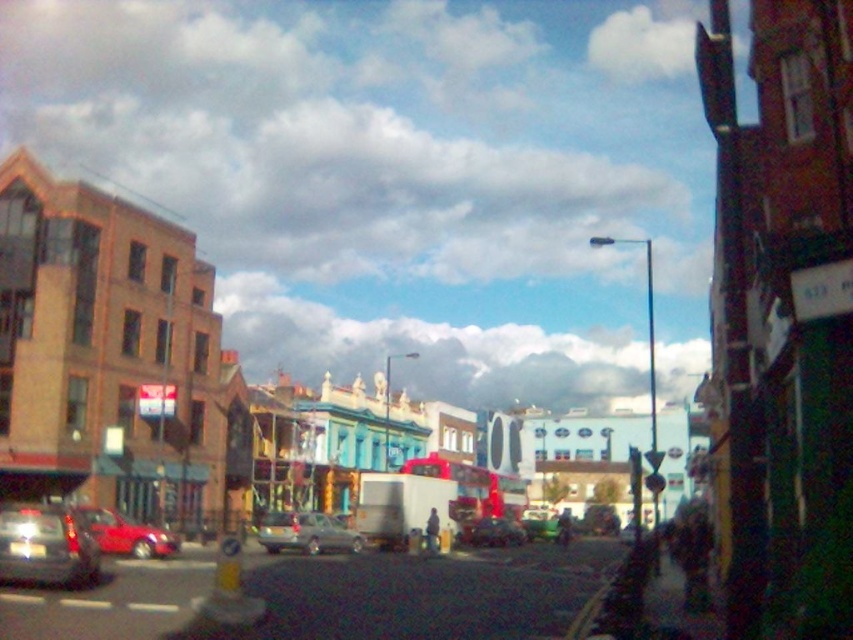
Who is more forward, (x=299, y=531) or (x=144, y=536)?

Point (x=144, y=536) is in front.

Can you confirm if metallic silver car at center is positioned above shiny red car at lower left?

No.

Which is behind, point (314, 532) or point (154, 534)?

Positioned behind is point (314, 532).

Find the location of a particular element. This screenshot has height=640, width=853. metallic silver car at center is located at coordinates (306, 532).

Does shiny red car at lower left have a lesser width compared to shiny silver car at center?

Yes, shiny red car at lower left is thinner than shiny silver car at center.

Between shiny red car at lower left and shiny silver car at center, which one appears on the right side from the viewer's perspective?

shiny silver car at center

Which is in front, point (157, 531) or point (492, 545)?

Point (157, 531)

At what (x,y) coordinates should I click in order to perform the action: click on shiny red car at lower left. Please return your answer as a coordinate pair (x, y). Looking at the image, I should click on (126, 534).

Is metallic silver car at center to the right of shiny silver car at center from the viewer's perspective?

No, metallic silver car at center is not to the right of shiny silver car at center.

Which is more to the right, metallic silver car at center or shiny silver car at center?

Positioned to the right is shiny silver car at center.

Is point (350, 536) positioned in front of point (488, 540)?

That is True.

What are the coordinates of `metallic silver car at center` in the screenshot? It's located at (306, 532).